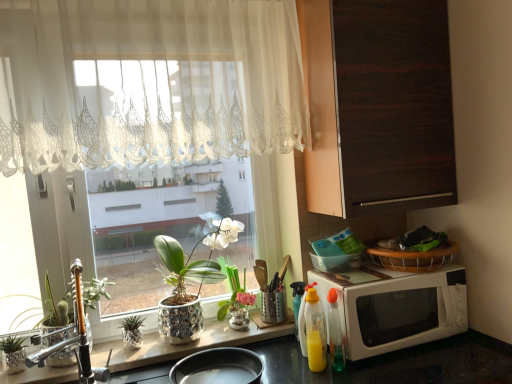
What are the coordinates of `free area in between translucent glass pineapple at lower center, the 3th houseplant from the left, and silver textured pot at center, the 4th houseplant positioned from the left` in the screenshot? It's located at (147, 350).